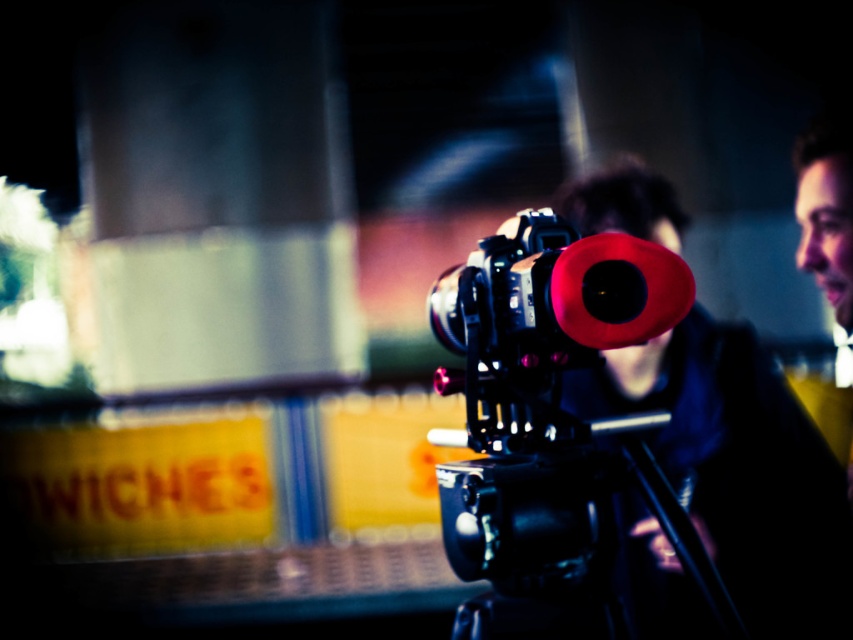
Between smooth black jacket at center and matte black camera at center, which one is positioned lower?

smooth black jacket at center is below.

Does smooth black jacket at center lie behind matte black camera at center?

Yes.

This screenshot has height=640, width=853. Find the location of `smooth black jacket at center`. smooth black jacket at center is located at coordinates (740, 468).

You are a GUI agent. You are given a task and a screenshot of the screen. Output one action in this format:
    pyautogui.click(x=<x>, y=<y>)
    Task: Click on the smooth black jacket at center
    
    Given the screenshot: What is the action you would take?
    pyautogui.click(x=740, y=468)

Can you confirm if black matte tripod at center is taller than matte black camera at center?

Yes, black matte tripod at center is taller than matte black camera at center.

Is point (718, 620) closer to viewer compared to point (561, 220)?

Yes.

This screenshot has height=640, width=853. What do you see at coordinates (556, 540) in the screenshot? I see `black matte tripod at center` at bounding box center [556, 540].

The width and height of the screenshot is (853, 640). I want to click on black matte tripod at center, so click(556, 540).

Based on the photo, does smooth black jacket at center appear on the left side of black matte tripod at center?

In fact, smooth black jacket at center is to the right of black matte tripod at center.

Who is positioned more to the left, smooth black jacket at center or black matte tripod at center?

black matte tripod at center

Which is behind, point (692, 353) or point (465, 612)?

The point (692, 353) is more distant.

The height and width of the screenshot is (640, 853). Find the location of `smooth black jacket at center`. smooth black jacket at center is located at coordinates (740, 468).